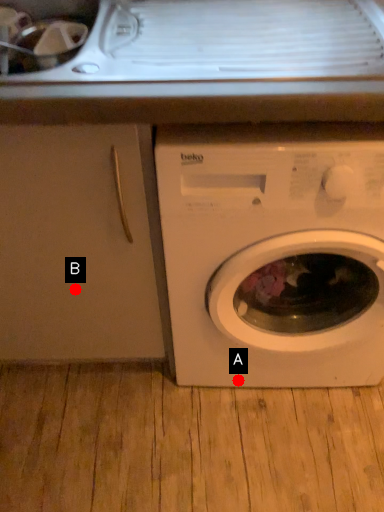
Question: Two points are circled on the image, labeled by A and B beside each circle. Which of the following is the farthest from the observer?

Choices:
 (A) A is further
 (B) B is further

Answer: (A)